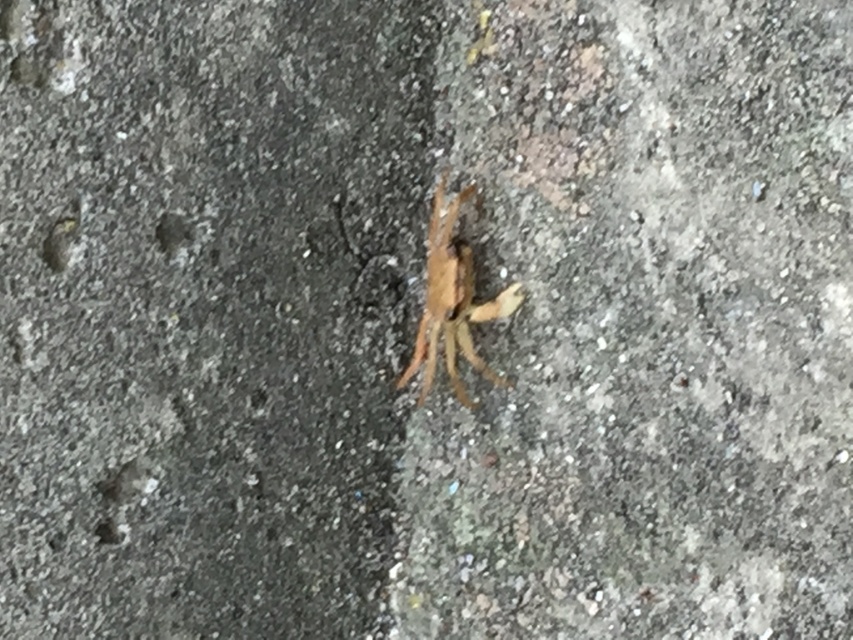
Consider the image. You are a small insect trying to cross the gray rough concrete at center. There is a brown fuzzy spider at center in your path. Which obstacle is bigger in size that you need to navigate around?

The gray rough concrete at center is larger in size compared to the brown fuzzy spider at center, so you should navigate around the gray rough concrete at center.

From the picture: You are a photographer trying to capture the spider on the concrete surface. You notice two points marked on your camera screen. The first point is at coordinate point (698, 358) and the second is at point (517, 284). Which point is closer to you, the photographer?

Point (698, 358) is closer to the viewer than point (517, 284).